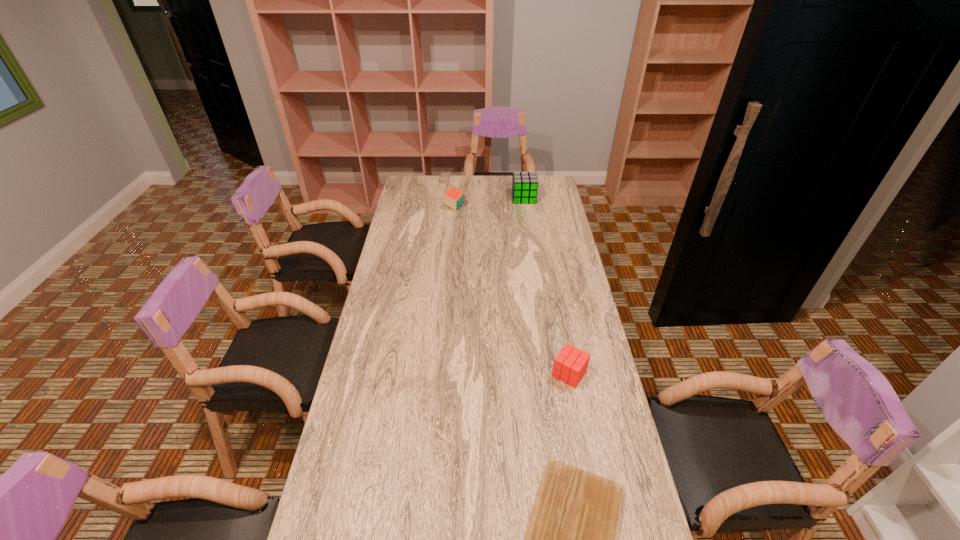
Select which cube is the second closest to the nearest cube. Please provide its 2D coordinates. Your answer should be formatted as a tuple, i.e. [(x, y)], where the tuple contains the x and y coordinates of a point satisfying the conditions above.

[(524, 184)]